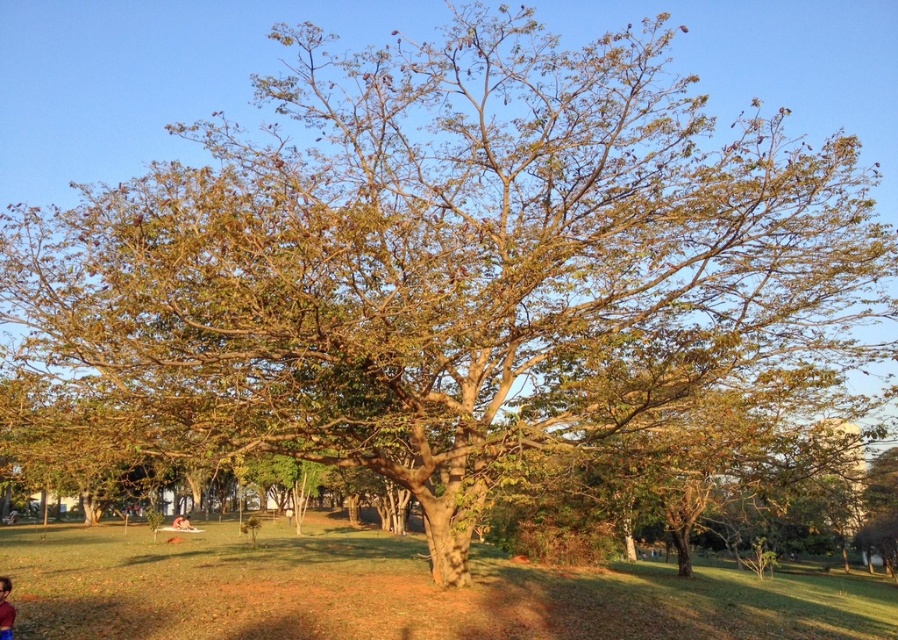
Between red shirt at lower left and light brown skin at lower center, which one is positioned lower?

light brown skin at lower center is lower down.

Does point (6, 634) lie behind point (185, 522)?

That is False.

You are a GUI agent. You are given a task and a screenshot of the screen. Output one action in this format:
    pyautogui.click(x=<x>, y=<y>)
    Task: Click on the red shirt at lower left
    The width and height of the screenshot is (898, 640).
    Given the screenshot: What is the action you would take?
    pyautogui.click(x=5, y=609)